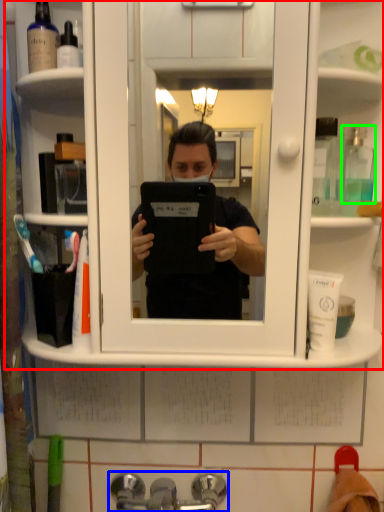
Question: Based on their relative distances, which object is farther from cabinet (highlighted by a red box)? Choose from tap (highlighted by a blue box) and mouthwash (highlighted by a green box).

Choices:
 (A) tap
 (B) mouthwash

Answer: (A)